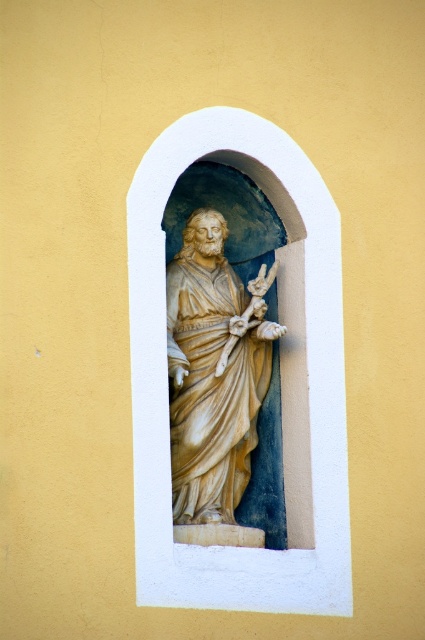
You are standing in front of a religious monument and see the white stone statue at center and the gold textured crucifix at center. Which object is located to the right of the other?

The white stone statue at center is positioned on the right side of gold textured crucifix at center.

You are standing in front of a yellow wall with a white arched niche. There is a point marked at coordinates (308, 387). What object is located at that point?

The point at coordinates (308, 387) corresponds to the white stone statue at center.